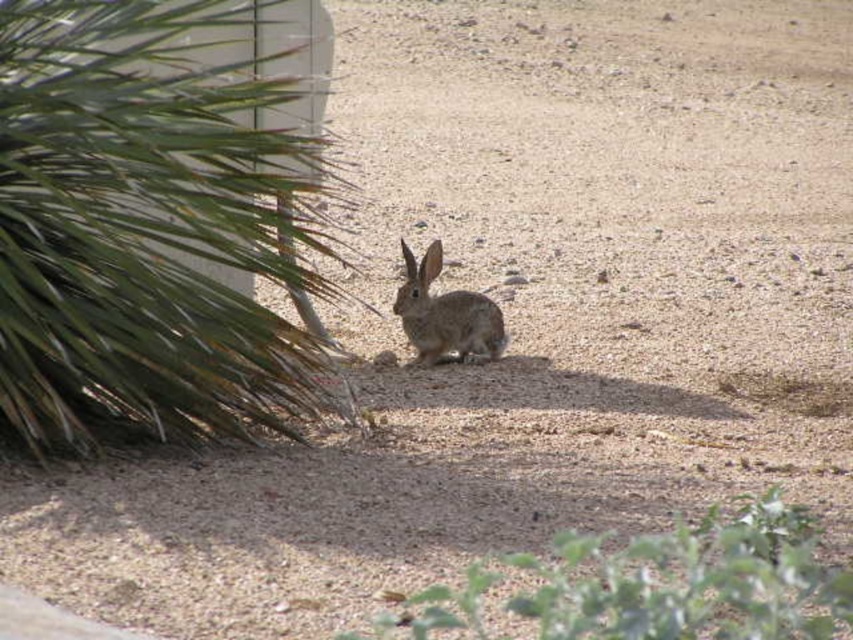
Question: Is green leafy plant at left wider than furry brown rabbit at center?

Choices:
 (A) no
 (B) yes

Answer: (B)

Question: Can you confirm if green leafy plant at left is positioned to the left of furry brown rabbit at center?

Choices:
 (A) yes
 (B) no

Answer: (A)

Question: Which object is the closest to the green leafy plant at lower right?

Choices:
 (A) green leafy plant at left
 (B) furry brown rabbit at center

Answer: (A)

Question: Can you confirm if green leafy plant at left is smaller than green leafy plant at lower right?

Choices:
 (A) no
 (B) yes

Answer: (A)

Question: Which point is closer to the camera?

Choices:
 (A) green leafy plant at left
 (B) furry brown rabbit at center
 (C) green leafy plant at lower right

Answer: (C)

Question: Which point is closer to the camera?

Choices:
 (A) green leafy plant at left
 (B) green leafy plant at lower right

Answer: (B)